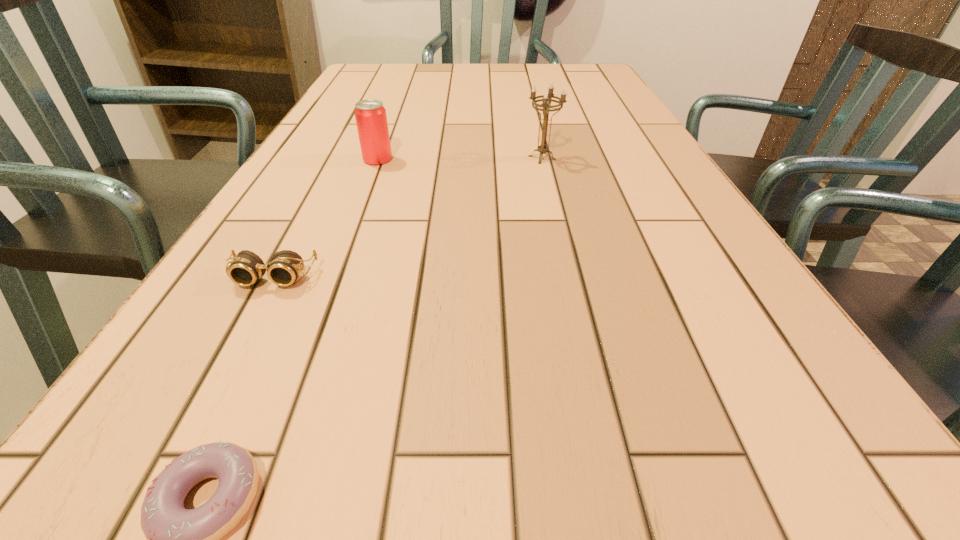
The height and width of the screenshot is (540, 960). What are the coordinates of `the rightmost object` in the screenshot? It's located at (547, 97).

This screenshot has width=960, height=540. I want to click on candle holder, so click(547, 97).

This screenshot has height=540, width=960. I want to click on can, so click(x=370, y=115).

Find the location of a particular element. This screenshot has width=960, height=540. the second nearest object is located at coordinates (245, 269).

Locate an element on the screen. The height and width of the screenshot is (540, 960). goggles is located at coordinates (245, 269).

Find the location of a particular element. Image resolution: width=960 pixels, height=540 pixels. vacant space located on the right of the rightmost object is located at coordinates (643, 158).

The image size is (960, 540). In order to click on vacant area situated 0.110m on the left of the can in this screenshot , I will do `click(312, 159)`.

This screenshot has width=960, height=540. Find the location of `vacant area situated through the lenses of the goggles`. vacant area situated through the lenses of the goggles is located at coordinates [x=244, y=333].

Locate an element on the screen. This screenshot has height=540, width=960. can that is at the left edge is located at coordinates (370, 115).

You are a GUI agent. You are given a task and a screenshot of the screen. Output one action in this format:
    pyautogui.click(x=<x>, y=<y>)
    Task: Click on the goggles present at the left edge
    
    Given the screenshot: What is the action you would take?
    pyautogui.click(x=245, y=269)